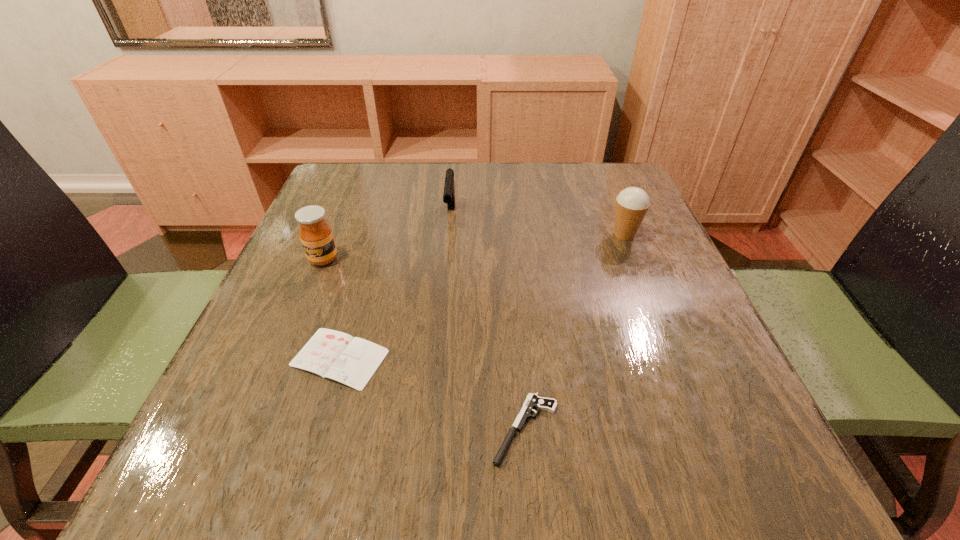
You are a GUI agent. You are given a task and a screenshot of the screen. Output one action in this format:
    pyautogui.click(x=<x>, y=<y>)
    Task: Click on the vacant region located 0.210m at the barrel of the taller pistol
    The width and height of the screenshot is (960, 540).
    Given the screenshot: What is the action you would take?
    pyautogui.click(x=444, y=297)

Locate an element on the screen. This screenshot has width=960, height=540. vacant area situated 0.110m on the front-facing side of the nearer pistol is located at coordinates (416, 429).

Find the location of a particular element. free space located on the front-facing side of the nearer pistol is located at coordinates (285, 429).

The width and height of the screenshot is (960, 540). Identify the location of vacant space situated 0.270m on the front-facing side of the nearer pistol. (305, 429).

Where is `free location located 0.400m on the back of the diary`? free location located 0.400m on the back of the diary is located at coordinates (384, 205).

The width and height of the screenshot is (960, 540). Find the location of `object at the far edge`. object at the far edge is located at coordinates coord(449,188).

At what (x,y) coordinates should I click in order to perform the action: click on object at the near edge. Please return your answer as a coordinate pair (x, y). The image size is (960, 540). Looking at the image, I should click on (532, 401).

Where is `honey that is at the left edge`? honey that is at the left edge is located at coordinates (316, 235).

Locate an element on the screen. The image size is (960, 540). diary present at the left edge is located at coordinates (352, 361).

Where is `object that is at the right edge`? object that is at the right edge is located at coordinates (632, 203).